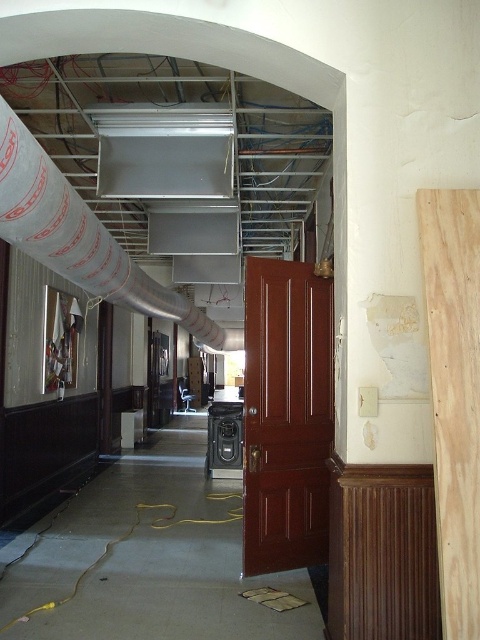
Question: Considering the relative positions of mahogany wood door at center and natural wood plank at right in the image provided, where is mahogany wood door at center located with respect to natural wood plank at right?

Choices:
 (A) below
 (B) above

Answer: (A)

Question: Which point is farther from the camera taking this photo?

Choices:
 (A) (456, 609)
 (B) (43, 579)
 (C) (275, 262)

Answer: (C)

Question: Which object is closer to the camera taking this photo?

Choices:
 (A) mahogany wood door at center
 (B) yellow rubber hose at center

Answer: (A)

Question: Considering the relative positions of mahogany wood door at center and white plastic pipe at upper left in the image provided, where is mahogany wood door at center located with respect to white plastic pipe at upper left?

Choices:
 (A) above
 (B) below

Answer: (B)

Question: Estimate the real-world distances between objects in this image. Which object is farther from the natural wood plank at right?

Choices:
 (A) white plastic pipe at upper left
 (B) mahogany wood door at center
 (C) yellow rubber hose at center

Answer: (C)

Question: From the image, what is the correct spatial relationship of yellow rubber hose at center in relation to white plastic pipe at upper left?

Choices:
 (A) left
 (B) right

Answer: (B)